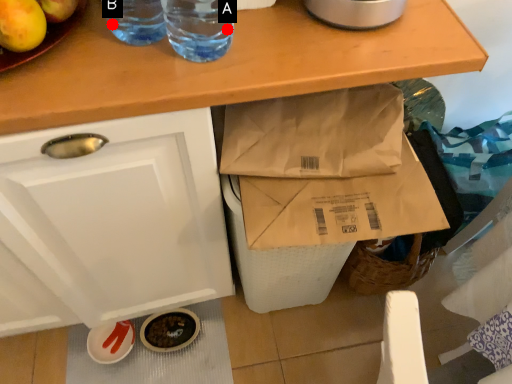
Question: Two points are circled on the image, labeled by A and B beside each circle. Which point is farther to the camera?

Choices:
 (A) A is further
 (B) B is further

Answer: (A)